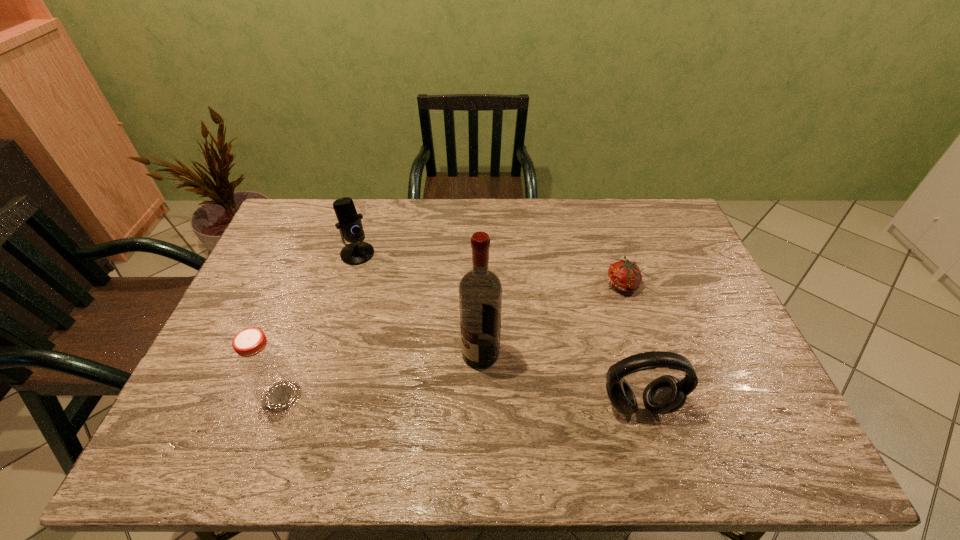
The image size is (960, 540). I want to click on bottle, so click(263, 366).

I want to click on headset, so coord(666,394).

At what (x,y) coordinates should I click in order to perform the action: click on the farthest object. Please return your answer as a coordinate pair (x, y). Looking at the image, I should click on (349, 224).

Find the location of `the fourth nearest object`. the fourth nearest object is located at coordinates (625, 276).

The width and height of the screenshot is (960, 540). I want to click on tomato, so click(625, 276).

Where is `the third object from right to left`? the third object from right to left is located at coordinates (480, 292).

Identify the location of the tallest object. (480, 292).

At what (x,y) coordinates should I click in order to perform the action: click on vacant area situated on the right of the bottle. Please return your answer as a coordinate pair (x, y). Looking at the image, I should click on (429, 396).

Where is `free point located 0.360m on the stand of the farthest object`? Image resolution: width=960 pixels, height=540 pixels. free point located 0.360m on the stand of the farthest object is located at coordinates (399, 343).

Find the location of a particular element. The image size is (960, 540). vacant space located on the stand of the farthest object is located at coordinates (374, 289).